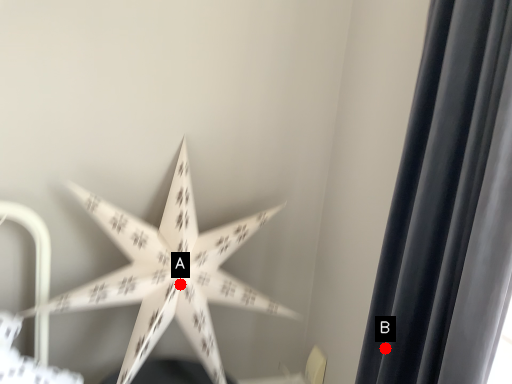
Question: Two points are circled on the image, labeled by A and B beside each circle. Which of the following is the closest to the observer?

Choices:
 (A) A is closer
 (B) B is closer

Answer: (B)